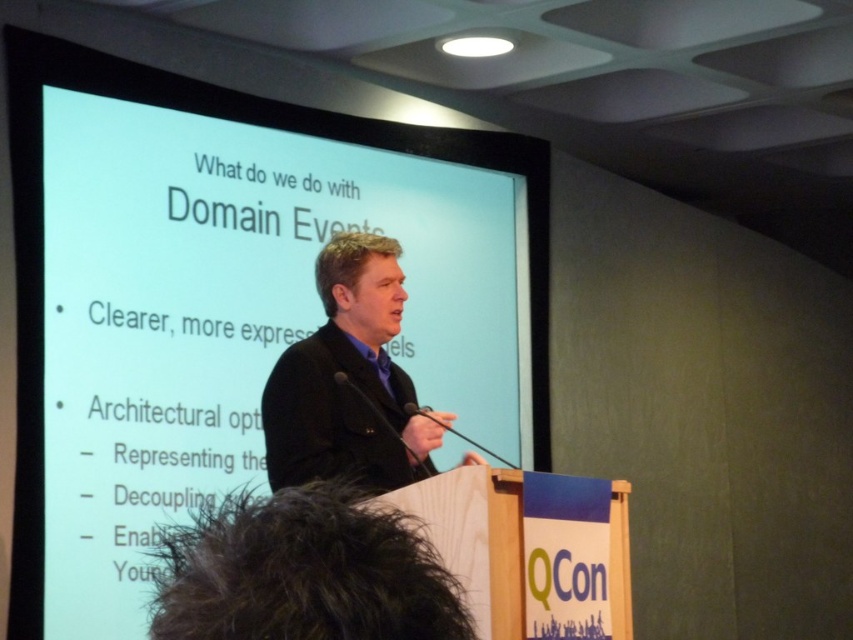
Which is in front, point (363, 188) or point (318, 371)?

Point (318, 371) is more forward.

What do you see at coordinates (228, 298) in the screenshot? I see `white glossy projection screen at upper center` at bounding box center [228, 298].

Between point (88, 380) and point (399, 388), which one is positioned behind?

Point (88, 380)

The image size is (853, 640). What are the coordinates of `white glossy projection screen at upper center` in the screenshot? It's located at (228, 298).